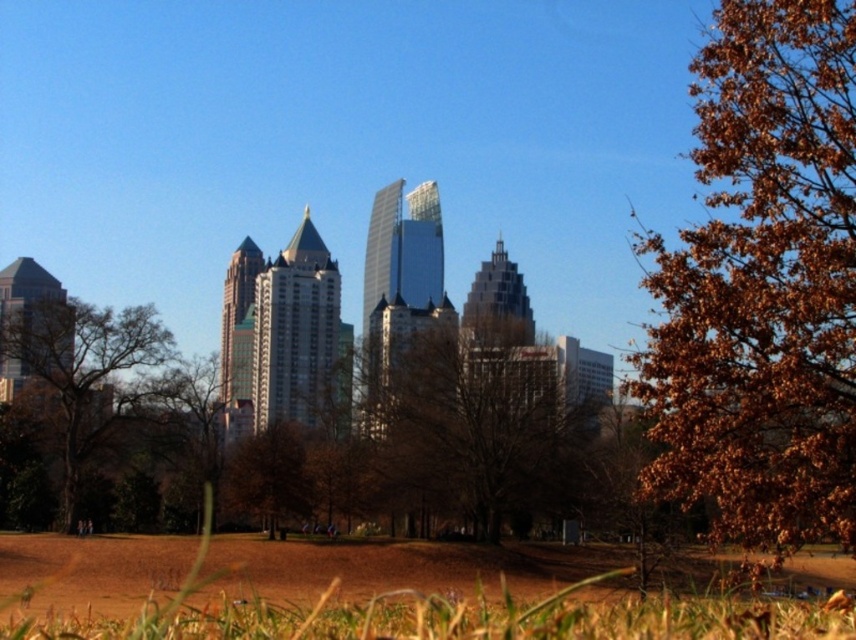
Looking at this image, is brown leafy tree at right to the left of brown matte tree at center from the viewer's perspective?

Incorrect, brown leafy tree at right is not on the left side of brown matte tree at center.

Who is more forward, (x=768, y=248) or (x=283, y=497)?

Point (x=768, y=248)

Identify the location of brown leafy tree at right. (762, 284).

Does brown leafy tree at right appear under brown leafy tree at center?

Actually, brown leafy tree at right is above brown leafy tree at center.

Is brown leafy tree at right shorter than brown leafy tree at center?

Incorrect, brown leafy tree at right's height does not fall short of brown leafy tree at center's.

Does point (804, 266) lie behind point (495, 486)?

No, it is in front of (495, 486).

This screenshot has height=640, width=856. Find the location of `brown leafy tree at right`. brown leafy tree at right is located at coordinates point(762,284).

Is brown leafy tree at right to the right of brown leafy tree at left from the viewer's perspective?

Yes, brown leafy tree at right is to the right of brown leafy tree at left.

Which is in front, point (750, 74) or point (107, 419)?

Positioned in front is point (750, 74).

Find the location of a particular element. Image resolution: width=856 pixels, height=640 pixels. brown leafy tree at right is located at coordinates (762, 284).